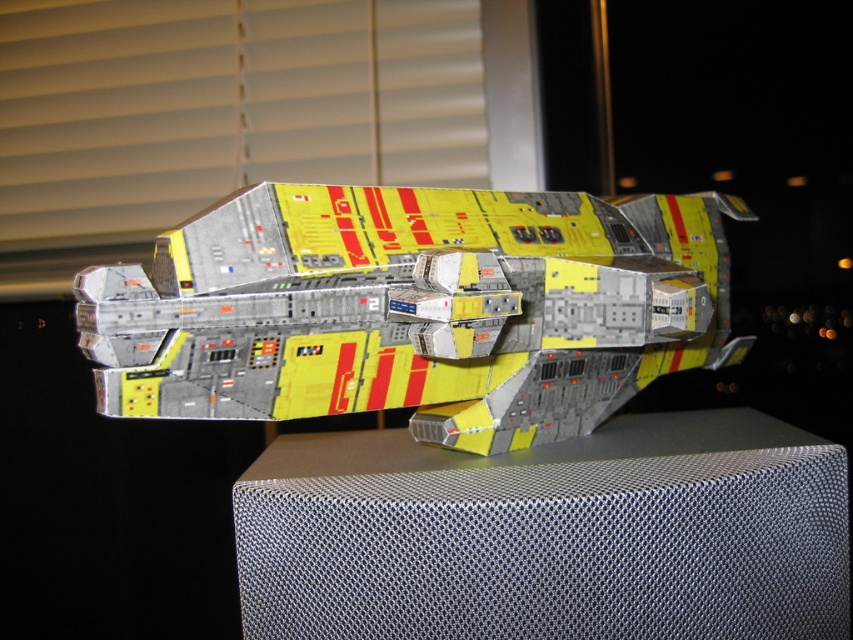
Is yellow matte/model ship at center closer to camera compared to metallic mesh table at center?

Yes, yellow matte/model ship at center is closer to the viewer.

In the scene shown: How much distance is there between yellow matte/model ship at center and metallic mesh table at center?

yellow matte/model ship at center and metallic mesh table at center are 7.04 inches apart.

Which is in front, point (480, 403) or point (256, 502)?

Point (256, 502) is in front.

Find the location of a particular element. Image resolution: width=853 pixels, height=640 pixels. yellow matte/model ship at center is located at coordinates (415, 308).